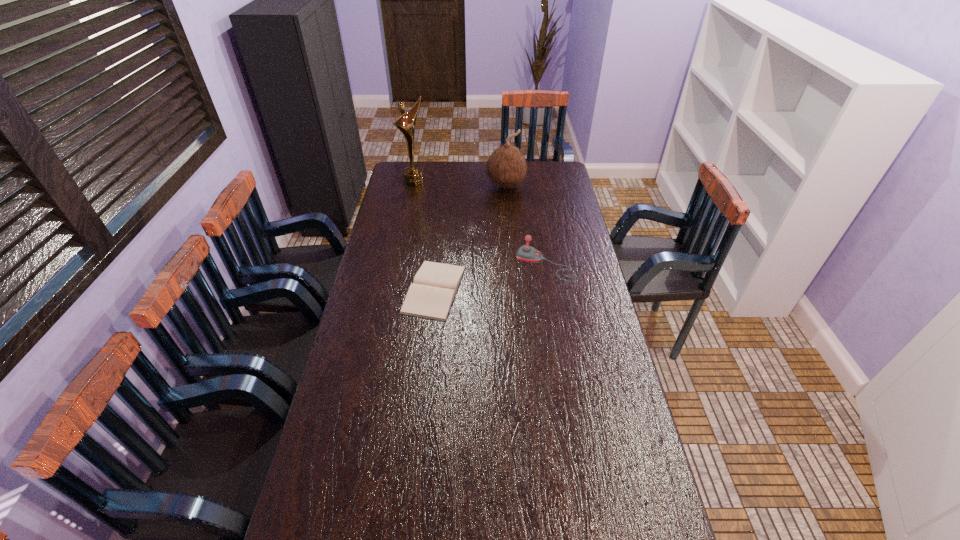
Find the location of a particular element. Bible is located at coordinates (431, 295).

I want to click on the second shortest object, so click(527, 253).

Identify the location of award. (x=413, y=175).

Where is `coconut`? The image size is (960, 540). coconut is located at coordinates (506, 167).

Identify the location of blank space located 0.140m on the front of the Bible. (427, 354).

This screenshot has width=960, height=540. What are the coordinates of `vacant area situated on the front of the joystick` in the screenshot? It's located at (551, 291).

Locate an element on the screen. Image resolution: width=960 pixels, height=540 pixels. blank area located on the front-facing side of the award is located at coordinates (439, 205).

Where is `vacant space located on the front-facing side of the award`? vacant space located on the front-facing side of the award is located at coordinates (429, 195).

The height and width of the screenshot is (540, 960). Identify the location of free space located 0.400m on the front-facing side of the award. (460, 226).

You are a GUI agent. You are given a task and a screenshot of the screen. Output one action in this format:
    pyautogui.click(x=<x>, y=<y>)
    Task: Click on the vacant space positioned on the surface of the second tallest object
    
    Given the screenshot: What is the action you would take?
    pyautogui.click(x=496, y=244)